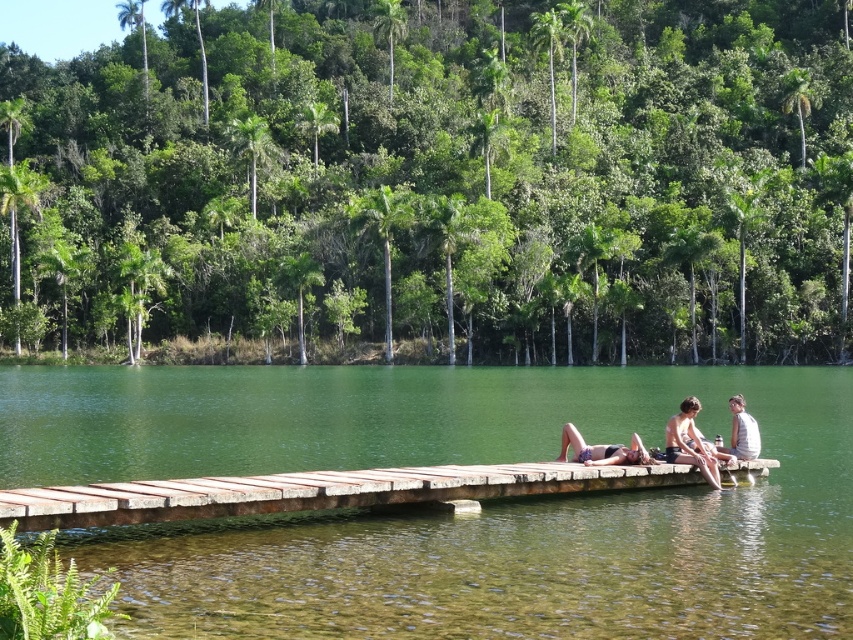
Which of these two, green translucent water at center or matte white skin at center, stands taller?

With more height is green translucent water at center.

Is green translucent water at center thinner than matte white skin at center?

No, green translucent water at center is not thinner than matte white skin at center.

Between point (165, 573) and point (701, 465), which one is positioned behind?

The point (701, 465) is behind.

You are a GUI agent. You are given a task and a screenshot of the screen. Output one action in this format:
    pyautogui.click(x=<x>, y=<y>)
    Task: Click on the green translucent water at center
    The width and height of the screenshot is (853, 640).
    Given the screenshot: What is the action you would take?
    pyautogui.click(x=444, y=515)

I want to click on matte skin couple at center, so click(x=672, y=444).

Which of these two, matte skin couple at center or matte white skin at center, stands shorter?

matte skin couple at center is shorter.

The image size is (853, 640). Find the location of `matte skin couple at center`. matte skin couple at center is located at coordinates (672, 444).

I want to click on matte skin couple at center, so click(672, 444).

Does weathered wood dock at center appear under matte skin couple at center?

Yes, weathered wood dock at center is below matte skin couple at center.

Between weathered wood dock at center and matte skin couple at center, which one has more height?

matte skin couple at center is taller.

Is point (527, 483) positioned before point (567, 426)?

That is True.

The width and height of the screenshot is (853, 640). Identify the location of weathered wood dock at center. (316, 492).